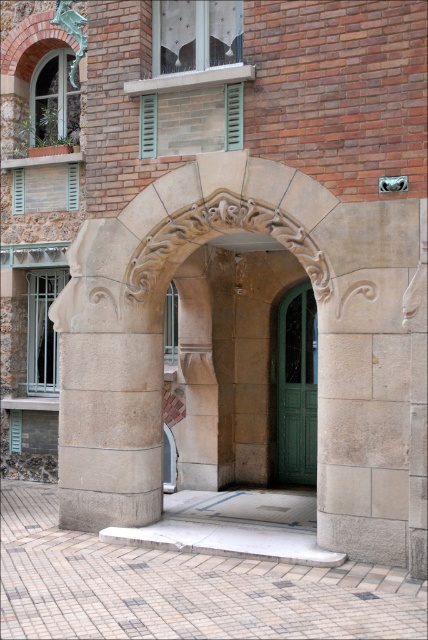
You are a painter who needs to move a large canvas through the green matte door at center and the green painted wood shutter at upper center. Which one do you think is wider?

The green matte door at center is wider than the green painted wood shutter at upper center according to the description.